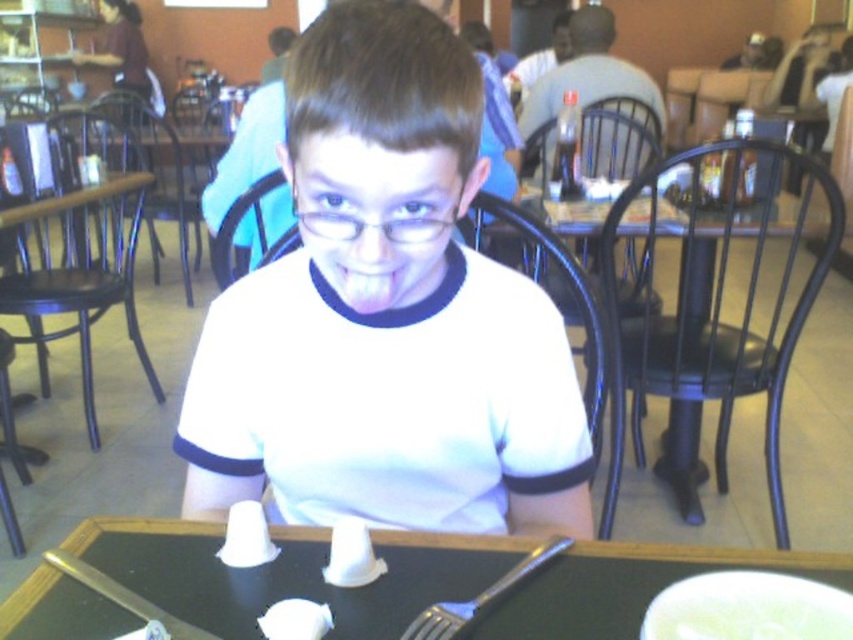
Can you confirm if white matte shirt at center is positioned to the left of shiny metal fork at lower center?

In fact, white matte shirt at center is to the right of shiny metal fork at lower center.

Is white matte shirt at center positioned in front of shiny metal fork at lower center?

Yes, white matte shirt at center is closer to the viewer.

Does point (451, 81) come behind point (206, 630)?

Yes.

Find the location of a particular element. This screenshot has height=640, width=853. white matte shirt at center is located at coordinates (386, 316).

Does black plastic table at lower center have a lesser width compared to black wood table at center?

Yes.

Is point (402, 547) behind point (827, 237)?

That is False.

Describe the element at coordinates (288, 573) in the screenshot. I see `black plastic table at lower center` at that location.

Identify the location of black plastic table at lower center. (288, 573).

Does black plastic table at lower center have a greater width compared to shiny metallic fork at lower center?

Correct, the width of black plastic table at lower center exceeds that of shiny metallic fork at lower center.

Does black plastic table at lower center have a larger size compared to shiny metallic fork at lower center?

Indeed, black plastic table at lower center has a larger size compared to shiny metallic fork at lower center.

Locate an element on the screen. This screenshot has width=853, height=640. black plastic table at lower center is located at coordinates (288, 573).